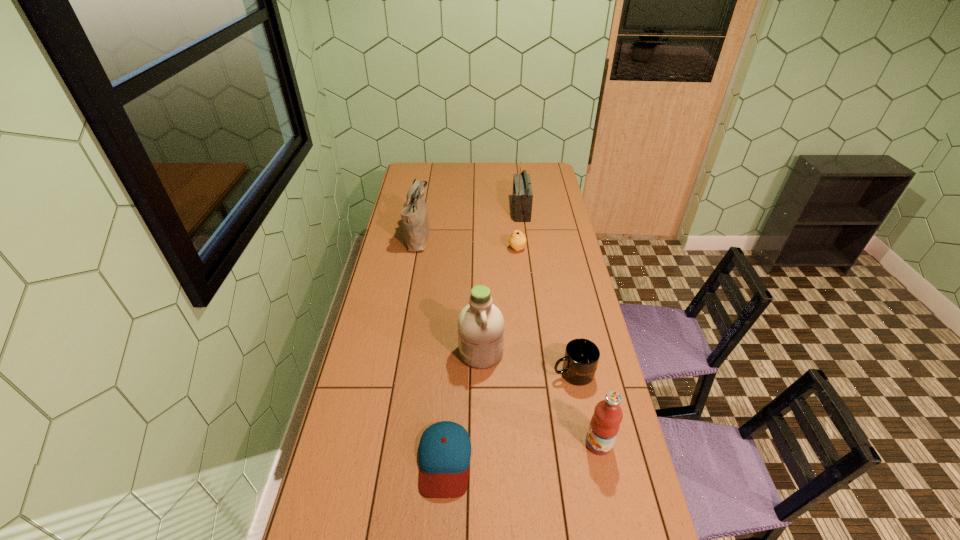
At what (x,y) coordinates should I click in order to perform the action: click on free location that satisfies the following two spatial constraints: 1. on the front label of the fourth tallest object; 2. with the bill of the shortest object facing forward. Please return your answer as a coordinate pair (x, y). Image resolution: width=960 pixels, height=540 pixels. Looking at the image, I should click on (602, 460).